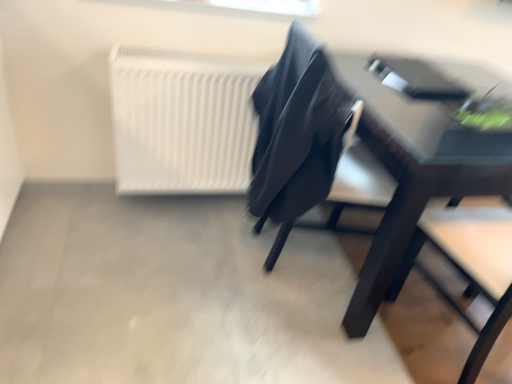
Question: Is white matte radiator at upper left to the right of matte black table at right from the viewer's perspective?

Choices:
 (A) yes
 (B) no

Answer: (B)

Question: Can you confirm if white matte radiator at upper left is shorter than matte black table at right?

Choices:
 (A) no
 (B) yes

Answer: (B)

Question: Does white matte radiator at upper left have a greater height compared to matte black table at right?

Choices:
 (A) no
 (B) yes

Answer: (A)

Question: Is white matte radiator at upper left far away from matte black table at right?

Choices:
 (A) no
 (B) yes

Answer: (A)

Question: Does white matte radiator at upper left turn towards matte black table at right?

Choices:
 (A) no
 (B) yes

Answer: (A)

Question: Considering the relative positions of matte black chair at center and white matte radiator at upper left in the image provided, is matte black chair at center to the left or to the right of white matte radiator at upper left?

Choices:
 (A) left
 (B) right

Answer: (B)

Question: Do you think matte black chair at center is within white matte radiator at upper left, or outside of it?

Choices:
 (A) outside
 (B) inside

Answer: (A)

Question: Is matte black chair at center in front of or behind white matte radiator at upper left in the image?

Choices:
 (A) front
 (B) behind

Answer: (A)

Question: From a real-world perspective, is matte black chair at center physically located above or below white matte radiator at upper left?

Choices:
 (A) above
 (B) below

Answer: (A)

Question: In terms of height, does matte black table at right look taller or shorter compared to matte black chair at center?

Choices:
 (A) short
 (B) tall

Answer: (B)

Question: Is matte black table at right situated inside matte black chair at center or outside?

Choices:
 (A) outside
 (B) inside

Answer: (A)

Question: From a real-world perspective, is matte black table at right positioned above or below matte black chair at center?

Choices:
 (A) above
 (B) below

Answer: (B)

Question: Is point (423, 183) closer or farther from the camera than point (333, 82)?

Choices:
 (A) closer
 (B) farther

Answer: (A)

Question: Is matte black chair at center to the left or to the right of matte black table at right in the image?

Choices:
 (A) right
 (B) left

Answer: (B)

Question: Looking at their shapes, would you say matte black chair at center is wider or thinner than matte black table at right?

Choices:
 (A) thin
 (B) wide

Answer: (A)